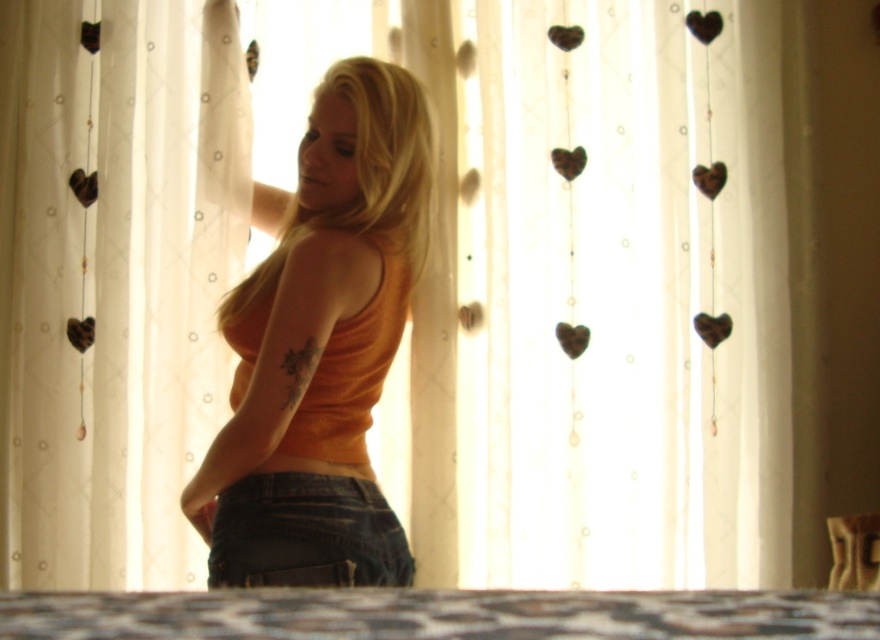
You are a photographer setting up a shoot in this room. You want to position a large lamp between the patterned fabric bed at lower center and the denim at center. Based on their positions, which object should the lamp be closer to?

The patterned fabric bed at lower center is in front of the denim at center, so the lamp should be placed closer to the denim at center to maintain proper spacing between them.

You are a photographer setting up a shot of the person in the scene. The orange matte tank top at center is your main subject. If your camera has a focal length of 50mm and you want to ensure the tank top fills the frame properly, what adjustment should you make based on its distance?

The orange matte tank top at center is 1.62 meters away from the camera. To ensure it fills the frame properly with a 50mm focal length, you should move closer to the subject or use a lens with a longer focal length.